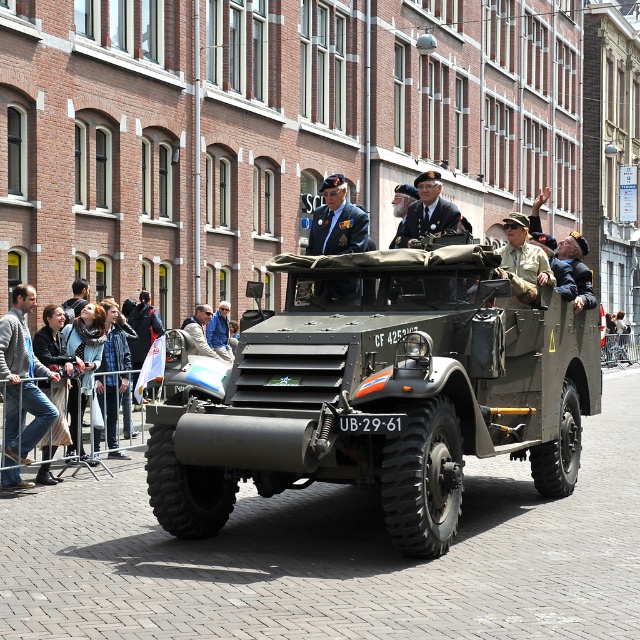
Question: Which of these objects is positioned farthest from the jeans at left?

Choices:
 (A) matte green military vehicle at center
 (B) light blue denim jacket at center

Answer: (B)

Question: From the image, what is the correct spatial relationship of matte green military vehicle at center in relation to jeans at left?

Choices:
 (A) below
 (B) above

Answer: (B)

Question: Does matte green military vehicle at center appear under jeans at left?

Choices:
 (A) yes
 (B) no

Answer: (B)

Question: Is jeans at left smaller than light blue denim jacket at center?

Choices:
 (A) yes
 (B) no

Answer: (B)

Question: Which point appears closest to the camera in this image?

Choices:
 (A) (237, 387)
 (B) (35, 406)
 (C) (225, 342)

Answer: (A)

Question: Among these objects, which one is farthest from the camera?

Choices:
 (A) matte green military vehicle at center
 (B) jeans at left

Answer: (B)